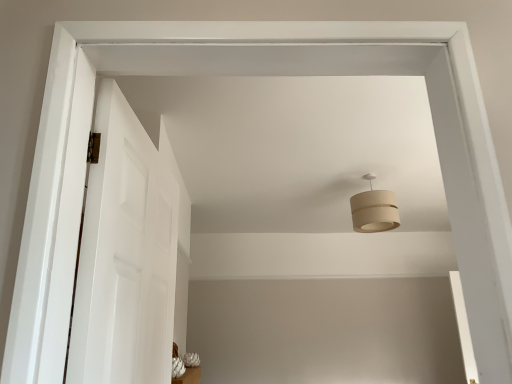
Question: From the image's perspective, does beige fabric lampshade at upper center appear lower than white glossy vase at lower center?

Choices:
 (A) no
 (B) yes

Answer: (A)

Question: Would you say beige fabric lampshade at upper center is a long distance from white glossy vase at lower center?

Choices:
 (A) no
 (B) yes

Answer: (B)

Question: Could you tell me if beige fabric lampshade at upper center is facing white glossy vase at lower center?

Choices:
 (A) no
 (B) yes

Answer: (A)

Question: Does beige fabric lampshade at upper center have a lesser height compared to white glossy vase at lower center?

Choices:
 (A) yes
 (B) no

Answer: (B)

Question: Is beige fabric lampshade at upper center behind white glossy vase at lower center?

Choices:
 (A) yes
 (B) no

Answer: (A)

Question: Is the position of beige fabric lampshade at upper center less distant than that of white glossy vase at lower center?

Choices:
 (A) no
 (B) yes

Answer: (A)

Question: Would you say white smooth door at left is part of beige fabric lampshade at upper center's contents?

Choices:
 (A) no
 (B) yes

Answer: (A)

Question: Does beige fabric lampshade at upper center have a larger size compared to white smooth door at left?

Choices:
 (A) no
 (B) yes

Answer: (A)

Question: Is beige fabric lampshade at upper center far from white smooth door at left?

Choices:
 (A) yes
 (B) no

Answer: (A)

Question: Can you confirm if beige fabric lampshade at upper center is thinner than white smooth door at left?

Choices:
 (A) no
 (B) yes

Answer: (A)

Question: Is beige fabric lampshade at upper center aimed at white smooth door at left?

Choices:
 (A) no
 (B) yes

Answer: (A)

Question: From a real-world perspective, is beige fabric lampshade at upper center positioned under white smooth door at left based on gravity?

Choices:
 (A) no
 (B) yes

Answer: (A)

Question: Is white smooth door at left bigger than white glossy vase at lower center?

Choices:
 (A) no
 (B) yes

Answer: (B)